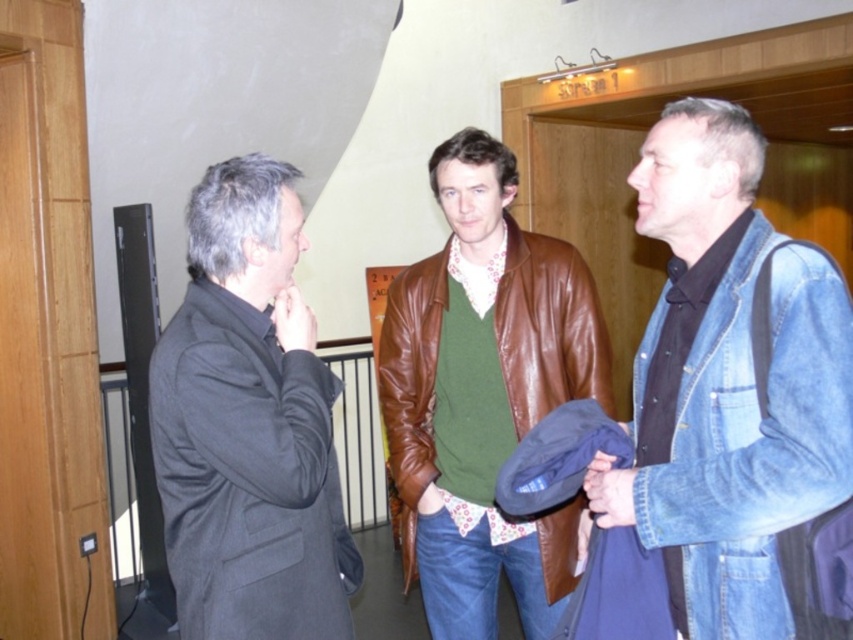
Can you confirm if denim jacket at right is positioned to the right of brown leather jacket at center?

Correct, you'll find denim jacket at right to the right of brown leather jacket at center.

Who is lower down, denim jacket at right or brown leather jacket at center?

brown leather jacket at center is below.

Is point (846, 323) positioned behind point (525, 291)?

No, it is in front of (525, 291).

Locate an element on the screen. This screenshot has height=640, width=853. denim jacket at right is located at coordinates (727, 384).

Who is higher up, denim jacket at right or dark gray wool coat at left?

denim jacket at right is higher up.

Between point (706, 260) and point (219, 508), which one is positioned behind?

Positioned behind is point (706, 260).

Where is `denim jacket at right`? The width and height of the screenshot is (853, 640). denim jacket at right is located at coordinates (727, 384).

Where is `denim jacket at right`? This screenshot has width=853, height=640. denim jacket at right is located at coordinates (727, 384).

Describe the element at coordinates (248, 424) in the screenshot. I see `dark gray wool coat at left` at that location.

Between dark gray wool coat at left and brown leather jacket at center, which one is positioned lower?

Positioned lower is brown leather jacket at center.

Describe the element at coordinates (248, 424) in the screenshot. This screenshot has height=640, width=853. I see `dark gray wool coat at left` at that location.

Identify the location of dark gray wool coat at left. (248, 424).